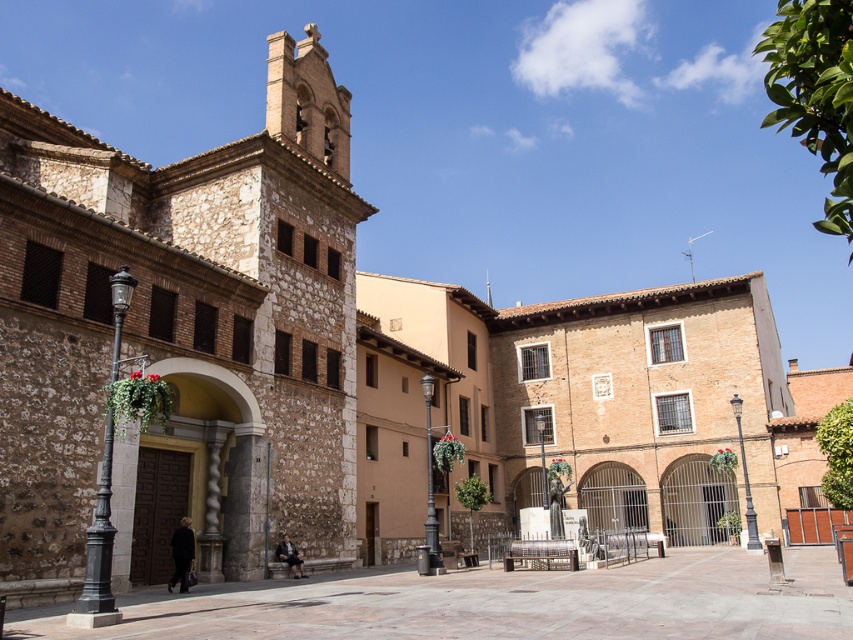
You are standing on the smooth stone pavement at center and want to enter the brown stone church at left. Which direction should you walk to reach the entrance?

Since the brown stone church at left is located above the smooth stone pavement at center, you should walk upwards towards the brown stone church at left to reach its entrance.